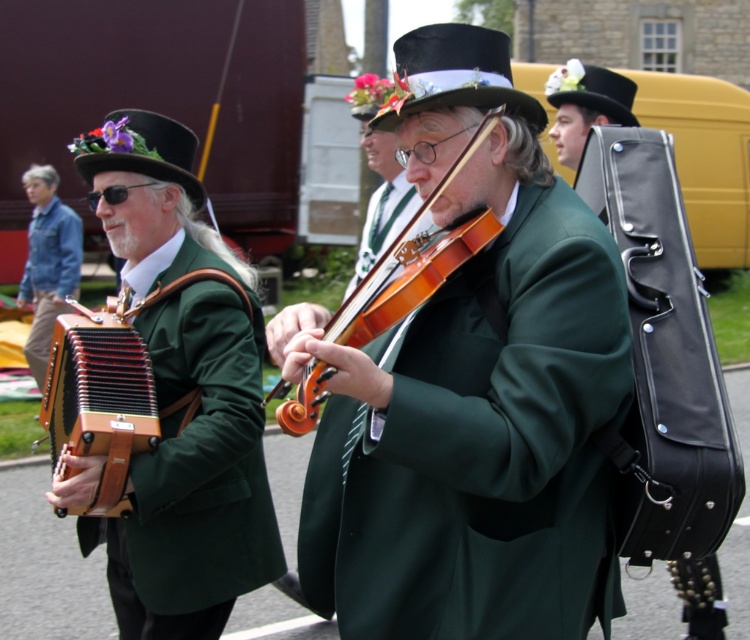
Looking at this image, you are a photographer trying to capture both the black felt top hat at center and the black felt top hat at upper center in a single frame. Which hat will appear wider in the photo?

The black felt top hat at center will appear wider in the photo because its width surpasses that of the black felt top hat at upper center.

You are a photographer trying to capture the wooden violin at center and the purple felt hat at left in your shot. Which object should you focus on first if you want to ensure both are in focus?

The wooden violin at center is closer to the viewer than the purple felt hat at left. To ensure both are in focus, focus on the wooden violin at center first as it is closer, and the depth of field may naturally include the farther purple felt hat at left.

You are a photographer setting up a shot of the two musicians. You need to ensure both the matte green coat at center and the wooden accordion at left are clearly visible. Given their sizes, which object will require more space in the frame to capture its details?

The matte green coat at center is larger in size than the wooden accordion at left, so it will require more space in the frame to capture its details.